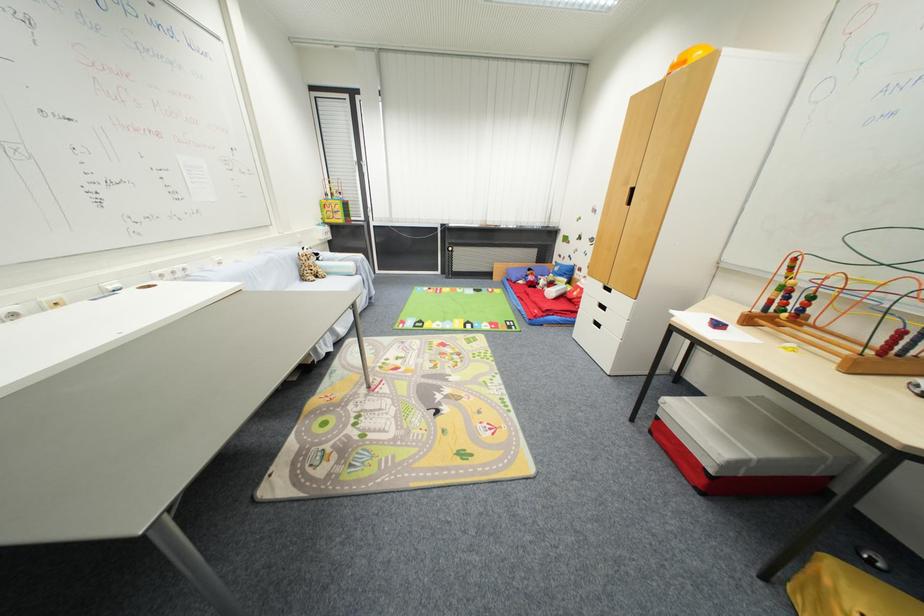
I want to click on sofa armrest, so click(359, 290).